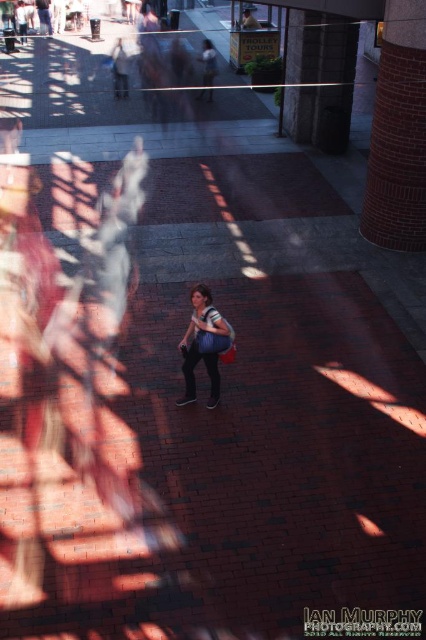
Can you confirm if brick textured pillar at right is thinner than matte blue shirt at center?

In fact, brick textured pillar at right might be wider than matte blue shirt at center.

Which of these two, brick textured pillar at right or matte blue shirt at center, stands shorter?

With less height is matte blue shirt at center.

Who is more forward, [405,26] or [198,323]?

Point [198,323] is more forward.

You are a GUI agent. You are given a task and a screenshot of the screen. Output one action in this format:
    pyautogui.click(x=<x>, y=<y>)
    Task: Click on the brick textured pillar at right
    The height and width of the screenshot is (640, 426).
    Given the screenshot: What is the action you would take?
    pyautogui.click(x=397, y=132)